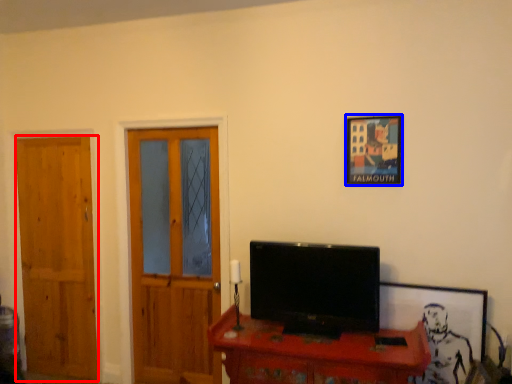
Question: Which object is further to the camera taking this photo, door (highlighted by a red box) or picture frame (highlighted by a blue box)?

Choices:
 (A) door
 (B) picture frame

Answer: (A)